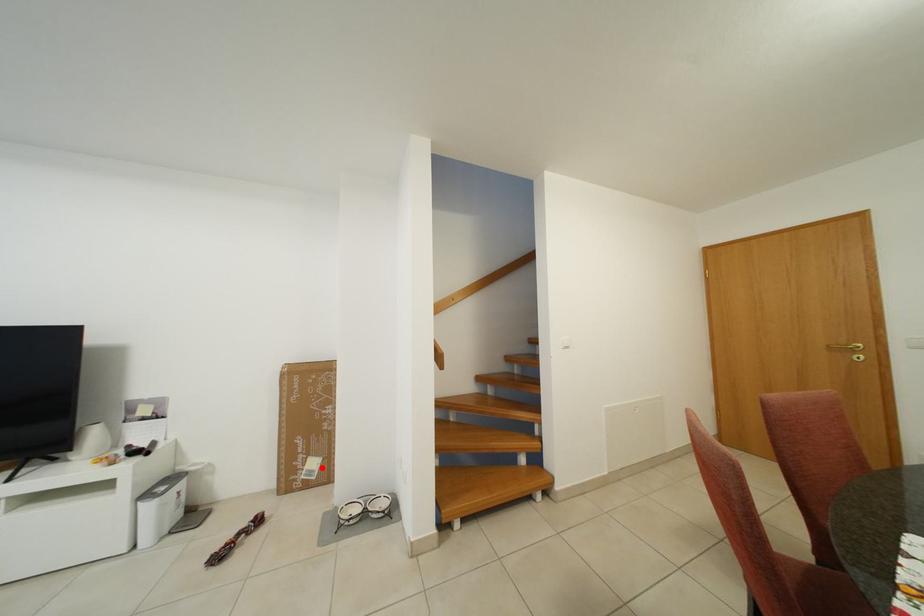
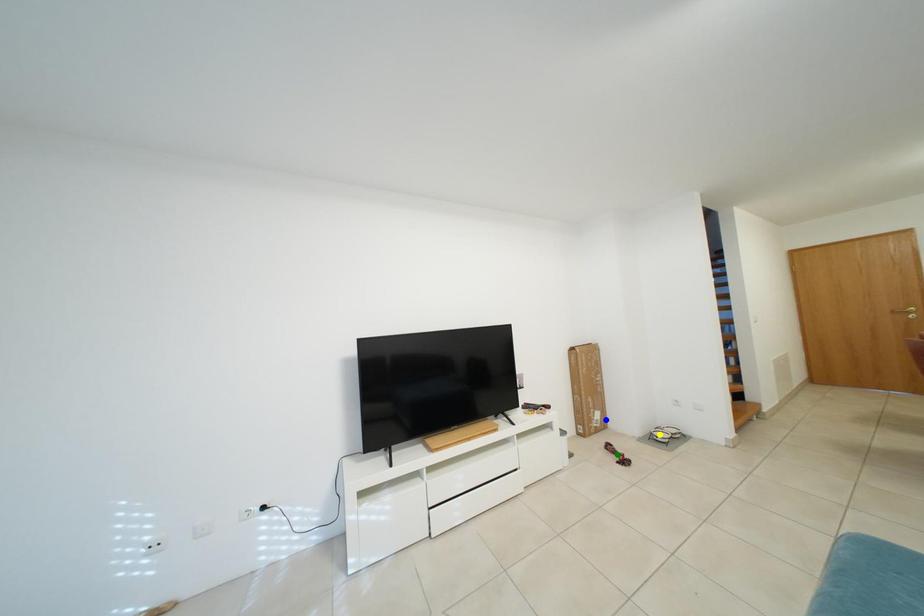
Question: I am providing you with two images of the same scene from different viewpoints. A red point is marked on the first image. You are given multiple points on the second image. Which point in image 2 is actually the same real-world point as the red point in image 1?

Choices:
 (A) yellow point
 (B) blue point
 (C) green point

Answer: (B)